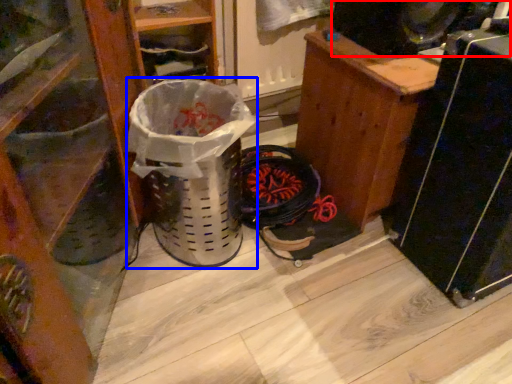
Question: Which point is closer to the camera, speaker (highlighted by a red box) or garbage (highlighted by a blue box)?

Choices:
 (A) speaker
 (B) garbage

Answer: (B)